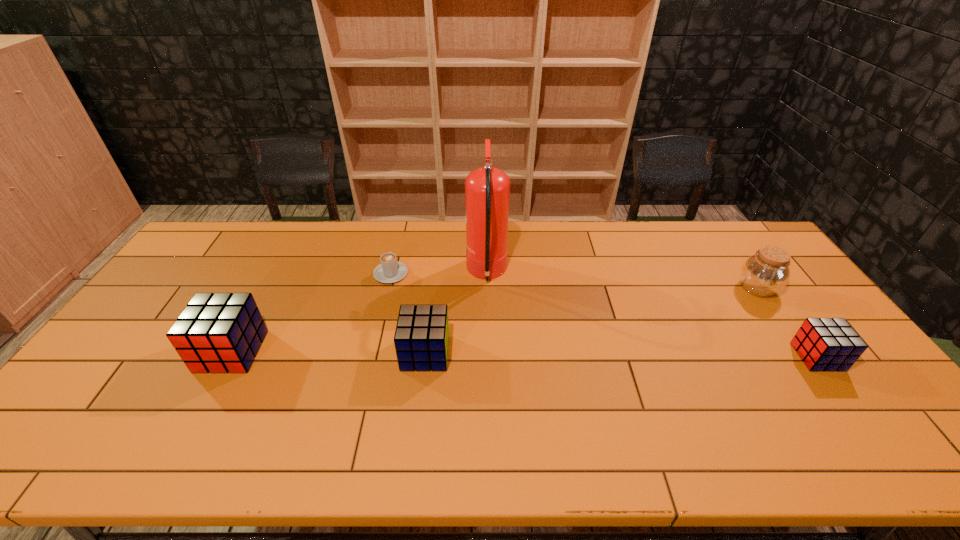
Choose which cube is the third nearest neighbor to the jar. Please provide its 2D coordinates. Your answer should be formatted as a tuple, i.e. [(x, y)], where the tuple contains the x and y coordinates of a point satisfying the conditions above.

[(216, 332)]

The image size is (960, 540). Find the location of `the closest cube relative to the second tallest cube`. the closest cube relative to the second tallest cube is located at coordinates (216, 332).

Identify the location of free location that satisfies the following two spatial constraints: 1. towards the nozzle of the fire extinguisher; 2. on the right side of the second shortest object. (489, 357).

Image resolution: width=960 pixels, height=540 pixels. I want to click on blank area in the image that satisfies the following two spatial constraints: 1. towards the nozzle of the fire extinguisher; 2. on the front side of the tallest cube, so click(488, 351).